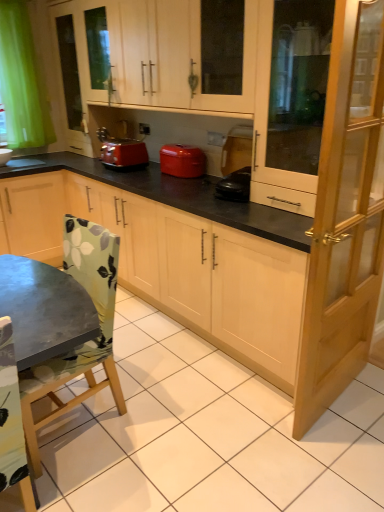
I want to click on vacant space underneath white glossy sink at lower left (from a real-world perspective), so click(11, 162).